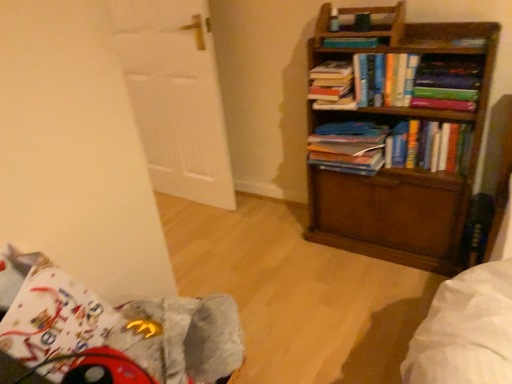
At what (x,y) coordinates should I click in order to perform the action: click on vacant region above hardcover books at upper center, acting as the third book starting from the bottom (from a real-world perspective). Please return your answer as a coordinate pair (x, y). The height and width of the screenshot is (384, 512). Looking at the image, I should click on (389, 50).